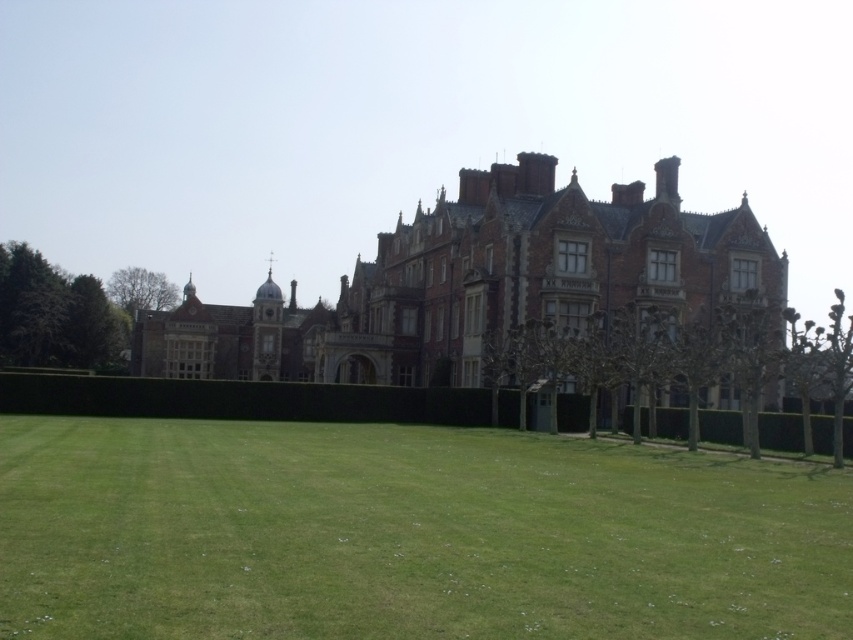
Is green grass at lower center positioned in front of brown brick mansion at center?

Yes.

Who is more forward, (109, 572) or (456, 301)?

Point (109, 572)

Is point (148, 477) farther from viewer compared to point (572, 317)?

No, it is in front of (572, 317).

At what (x,y) coordinates should I click in order to perform the action: click on green grass at lower center. Please return your answer as a coordinate pair (x, y). Image resolution: width=853 pixels, height=640 pixels. Looking at the image, I should click on (407, 534).